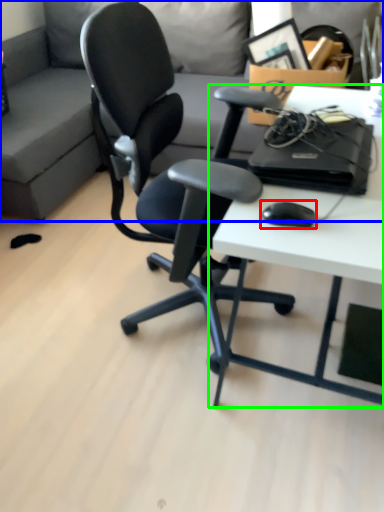
Question: Which object is the farthest from mouse (highlighted by a red box)? Choose among these: studio couch (highlighted by a blue box) or desk (highlighted by a green box).

Choices:
 (A) studio couch
 (B) desk

Answer: (A)